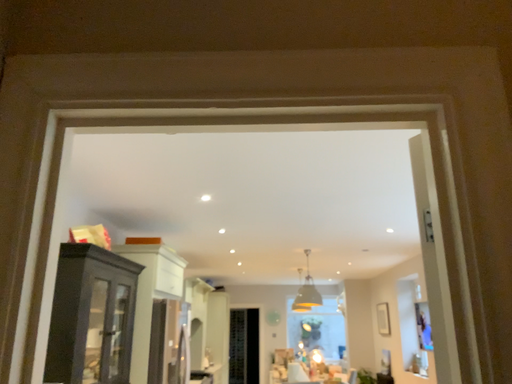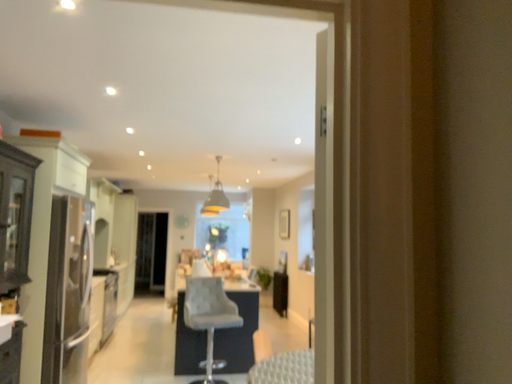
Question: How did the camera likely rotate when shooting the video?

Choices:
 (A) rotated upward
 (B) rotated downward

Answer: (B)